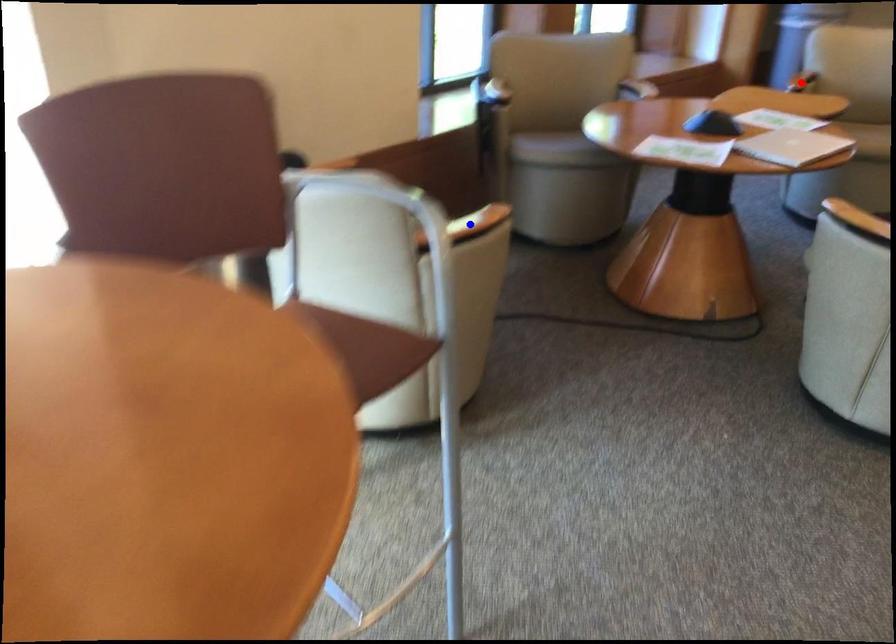
Question: Which of the two points in the image is closer to the camera?

Choices:
 (A) Blue point is closer.
 (B) Red point is closer.

Answer: (A)